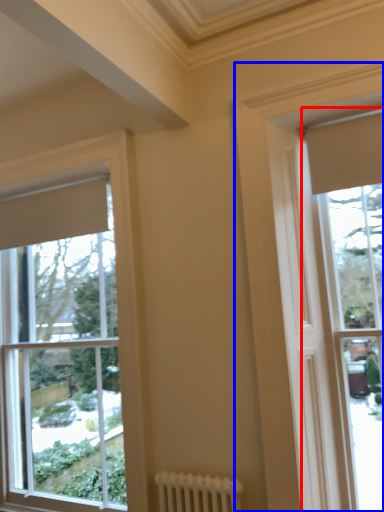
Question: Which of the following is the closest to the observer, window (highlighted by a red box) or window (highlighted by a blue box)?

Choices:
 (A) window
 (B) window

Answer: (B)